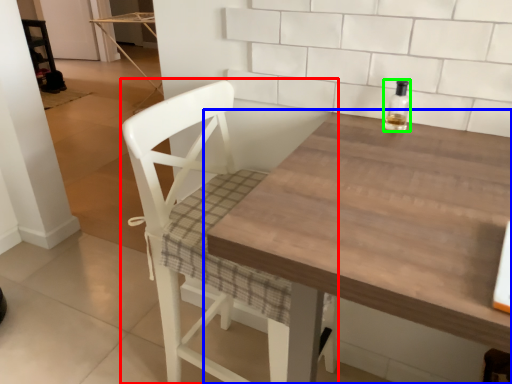
Question: Which object is positioned closest to chair (highlighted by a red box)? Select from table (highlighted by a blue box) and bottle (highlighted by a green box).

Choices:
 (A) table
 (B) bottle

Answer: (A)